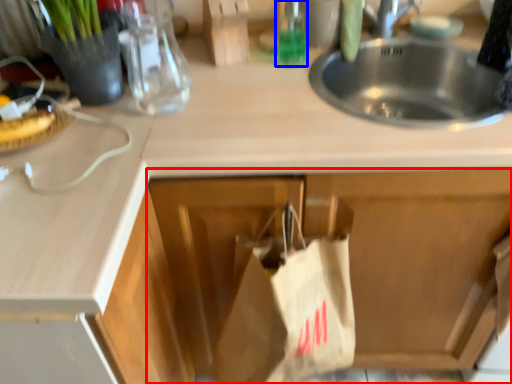
Question: Which object is closer to the camera taking this photo, cabinetry (highlighted by a red box) or bottle (highlighted by a blue box)?

Choices:
 (A) cabinetry
 (B) bottle

Answer: (A)